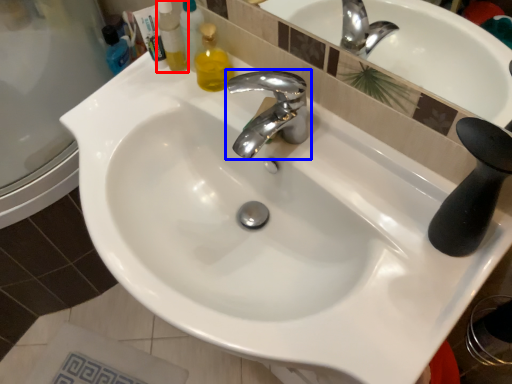
Question: Which object appears farthest to the camera in this image, cleaning product (highlighted by a red box) or tap (highlighted by a blue box)?

Choices:
 (A) cleaning product
 (B) tap

Answer: (A)